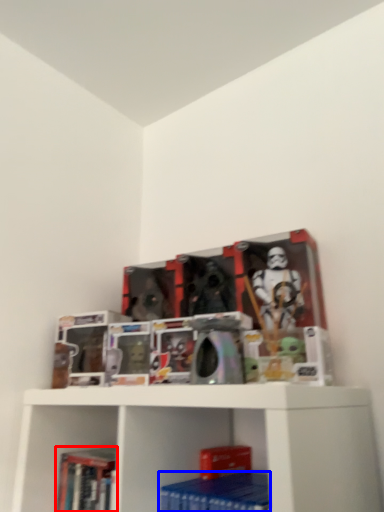
Question: Which of the following is the farthest to the observer, book (highlighted by a red box) or paperback book (highlighted by a blue box)?

Choices:
 (A) book
 (B) paperback book

Answer: (A)